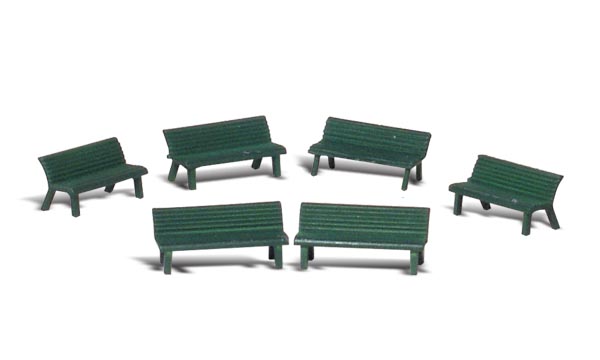
The width and height of the screenshot is (600, 360). Identify the location of two front benches. (340, 238), (214, 235).